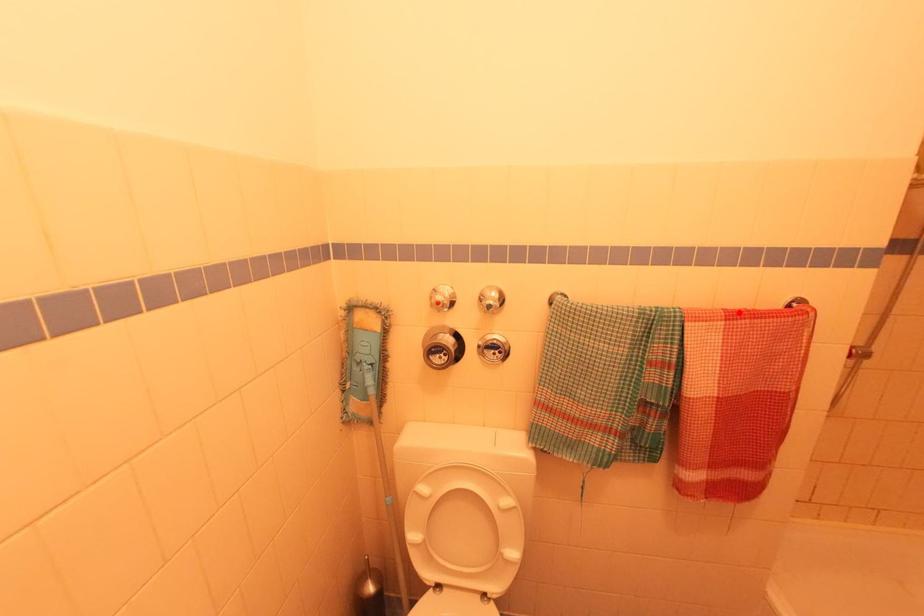
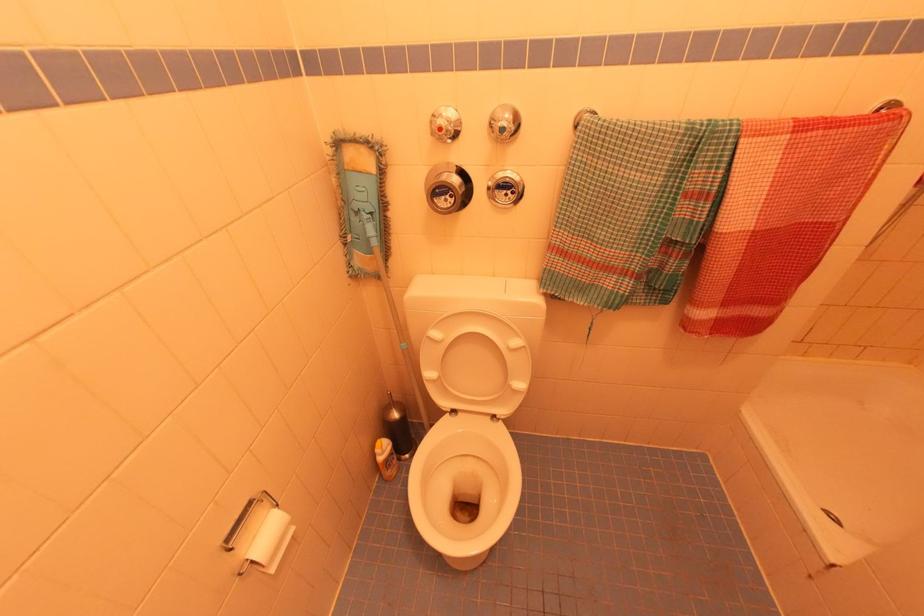
Find the pixel in the second image that matches the highlighted location in the first image.

(812, 122)